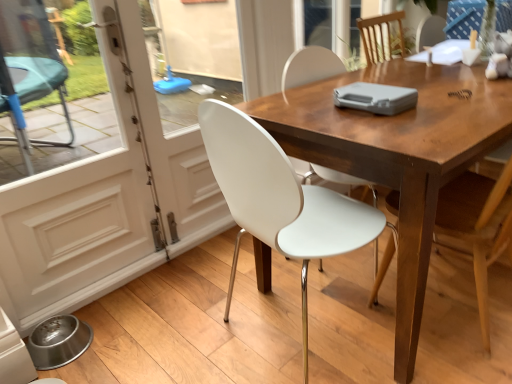
Question: Does wooden chair at center, the 1th chair from the right, have a smaller size compared to white glossy screen door at left, positioned as the 1th screen door in left-to-right order?

Choices:
 (A) yes
 (B) no

Answer: (B)

Question: Does wooden chair at center, the 1th chair from the right, lie behind white glossy screen door at left, which appears as the 2th screen door when viewed from the right?

Choices:
 (A) yes
 (B) no

Answer: (B)

Question: Is wooden chair at center, the 1th chair from the right, shorter than white glossy screen door at left, which appears as the 2th screen door when viewed from the right?

Choices:
 (A) yes
 (B) no

Answer: (A)

Question: From the image's perspective, is wooden chair at center, the 1th chair from the right, beneath white glossy screen door at left, positioned as the 1th screen door in left-to-right order?

Choices:
 (A) no
 (B) yes

Answer: (B)

Question: Are wooden chair at center, the second chair from the left, and white glossy screen door at left, which appears as the 2th screen door when viewed from the right, located far from each other?

Choices:
 (A) no
 (B) yes

Answer: (B)

Question: Does wooden chair at center, the second chair from the left, have a greater height compared to white glossy screen door at left, which appears as the 2th screen door when viewed from the right?

Choices:
 (A) no
 (B) yes

Answer: (A)

Question: Is white glossy screen door at left, marked as the 1th screen door in a right-to-left arrangement, not near wooden table at center?

Choices:
 (A) yes
 (B) no

Answer: (A)

Question: Is white glossy screen door at left, which is the 2th screen door from left to right, further to the viewer compared to wooden table at center?

Choices:
 (A) no
 (B) yes

Answer: (B)

Question: From a real-world perspective, is white glossy screen door at left, marked as the 1th screen door in a right-to-left arrangement, positioned under wooden table at center based on gravity?

Choices:
 (A) yes
 (B) no

Answer: (B)

Question: Does white glossy screen door at left, which is the 2th screen door from left to right, come in front of wooden table at center?

Choices:
 (A) yes
 (B) no

Answer: (B)

Question: Is white glossy screen door at left, which is the 2th screen door from left to right, wider than wooden table at center?

Choices:
 (A) no
 (B) yes

Answer: (A)

Question: Can you confirm if white glossy screen door at left, marked as the 1th screen door in a right-to-left arrangement, is positioned to the right of wooden table at center?

Choices:
 (A) yes
 (B) no

Answer: (B)

Question: Considering the relative sizes of white plastic chair at center, marked as the second chair in a right-to-left arrangement, and wooden chair at center, the second chair from the left, in the image provided, is white plastic chair at center, marked as the second chair in a right-to-left arrangement, smaller than wooden chair at center, the second chair from the left,?

Choices:
 (A) yes
 (B) no

Answer: (B)